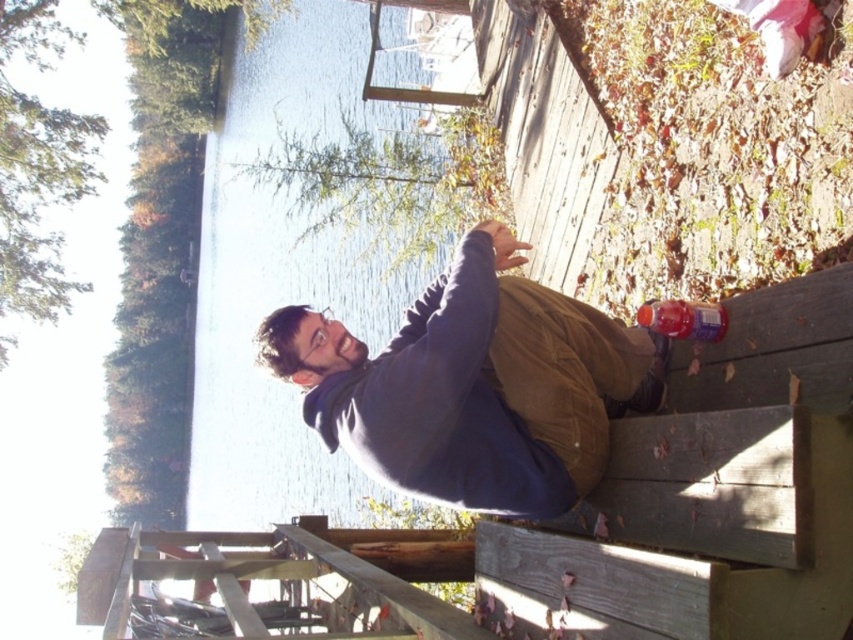
You are standing on the wooden deck by the lake and see the point at coordinates (474, 385). What object is located at that point?

The matte blue hoodie at center is located at point (474, 385).

What are the coordinates of the matte blue hoodie at center in the image?

The matte blue hoodie at center is located at point (474, 385).

You are a photographer standing at the edge of the wooden deck. You want to take a photo of the matte blue hoodie at center and the translucent plastic bottle at lower right so that both are clearly visible in the frame. Based on their distance apart, is it possible to capture both in a single shot without moving the camera?

The matte blue hoodie at center is 2.25 meters away from the translucent plastic bottle at lower right. Since they are within a reasonable distance apart, it is possible to capture both in a single shot without moving the camera.